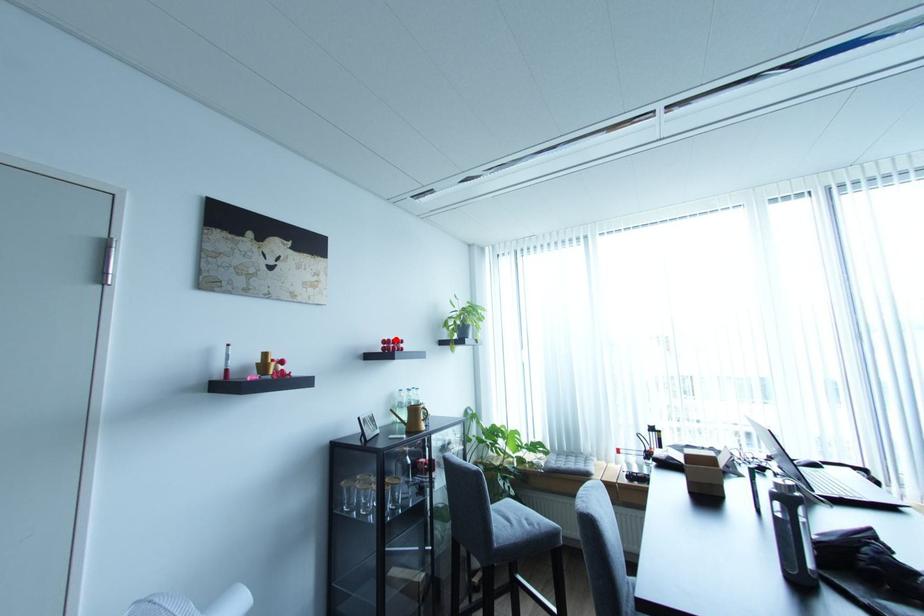
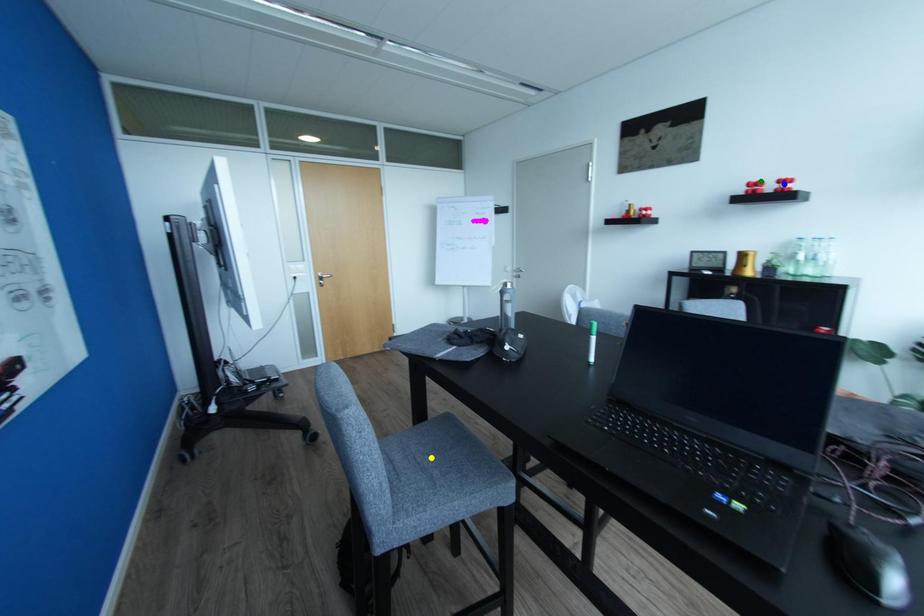
Question: I am providing you with two images of the same scene from different viewpoints. A red point is marked on the first image. You are given multiple points on the second image. In image 2, which mark is for the same physical point as the one in image 1?

Choices:
 (A) green point
 (B) blue point
 (C) yellow point

Answer: (A)